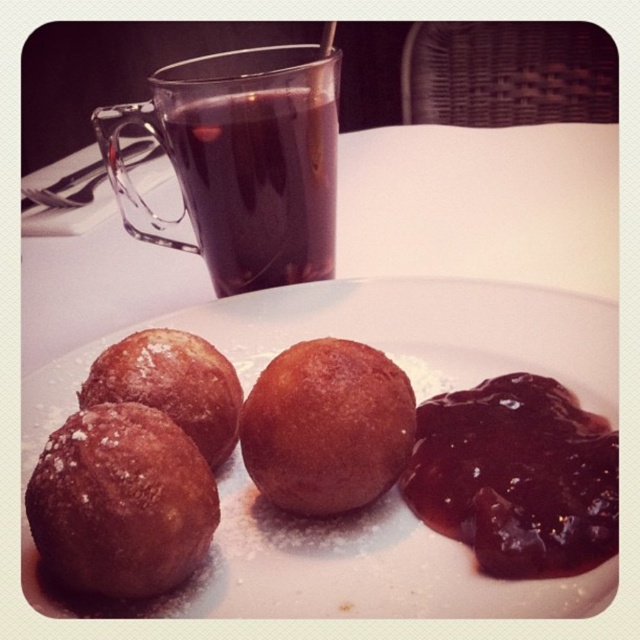
Question: Does crispy golden-brown donut at lower left appear under golden brown doughnut at center?

Choices:
 (A) no
 (B) yes

Answer: (B)

Question: Estimate the real-world distances between objects in this image. Which object is farther from the shiny dark jam at lower right?

Choices:
 (A) crispy golden-brown donut at lower left
 (B) golden brown doughnut at center
 (C) sugared brown donut at center

Answer: (C)

Question: Can you confirm if sugared doughnuts at center is positioned to the left of crispy golden-brown donut at lower left?

Choices:
 (A) no
 (B) yes

Answer: (A)

Question: Which is nearer to the sugared brown donut at center?

Choices:
 (A) dark brown liquid at upper center
 (B) sugared doughnuts at center
 (C) crispy golden-brown donut at lower left

Answer: (C)

Question: Among these objects, which one is nearest to the camera?

Choices:
 (A) dark brown liquid at upper center
 (B) crispy golden-brown donut at lower left

Answer: (B)

Question: Is dark brown liquid at upper center smaller than sugared brown donut at center?

Choices:
 (A) no
 (B) yes

Answer: (A)